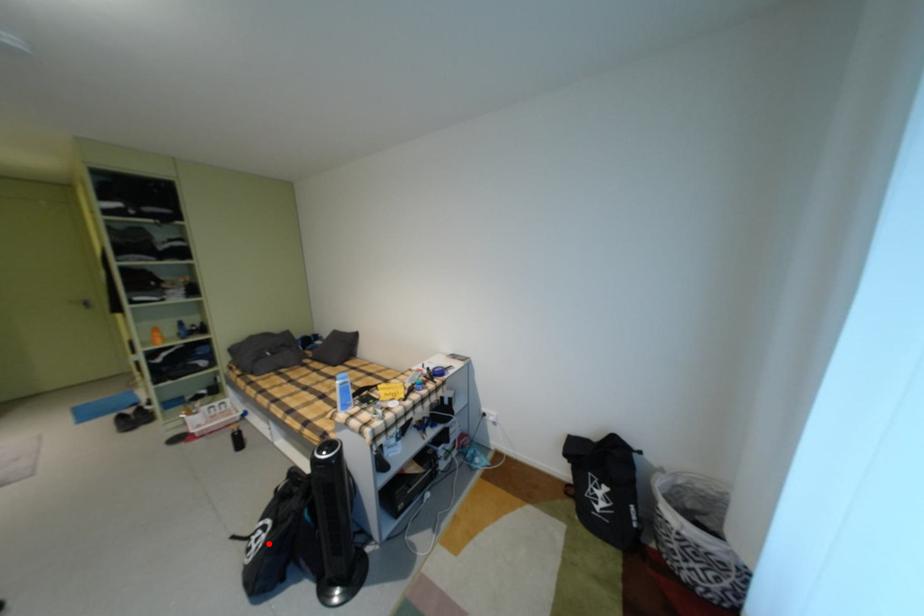
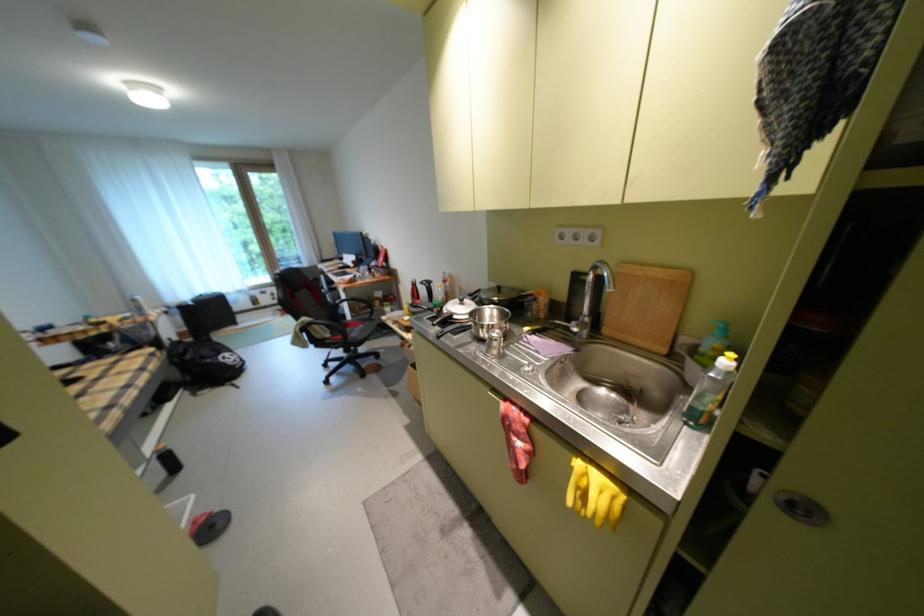
In the second image, find the point that corresponds to the highlighted location in the first image.

(239, 358)